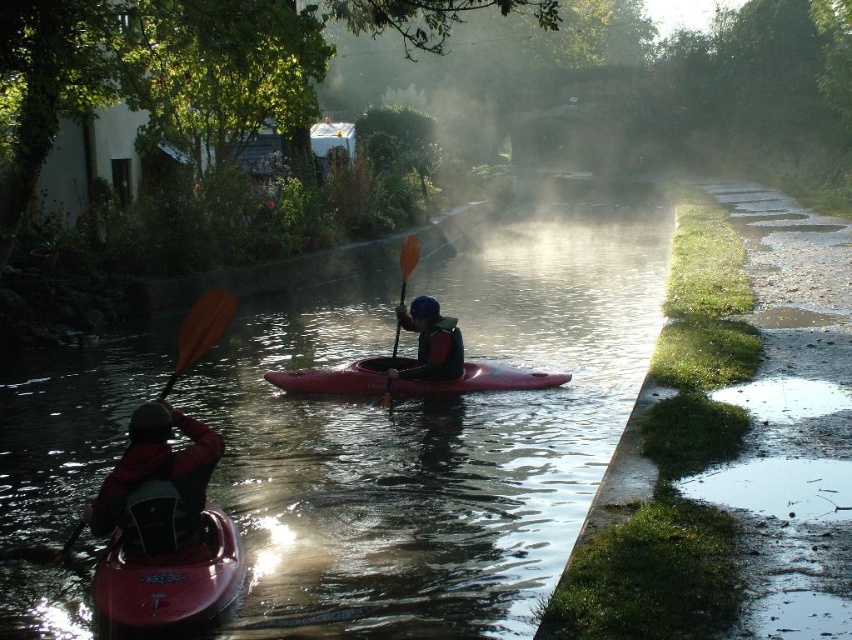
You are a photographer planning to take a photo of the matte black kayak at left and the orange paddle at center. Since you want to ensure both are clearly visible, which object should you focus on first to avoid blurriness, considering their sizes?

The matte black kayak at left is smaller than the orange paddle at center, so you should focus on the orange paddle at center first because larger objects often require more precise focus to ensure clarity.

You are standing on the bank of the canal and see the matte red canoe at lower left. If you want to throw a lifebuoy to the canoe, will it reach them if you can throw up to 5 meters?

The matte red canoe at lower left and viewer are 5.07 meters apart. Since the viewer can throw up to 5 meters, the lifebuoy will not reach them as the distance is slightly beyond the throwing range.